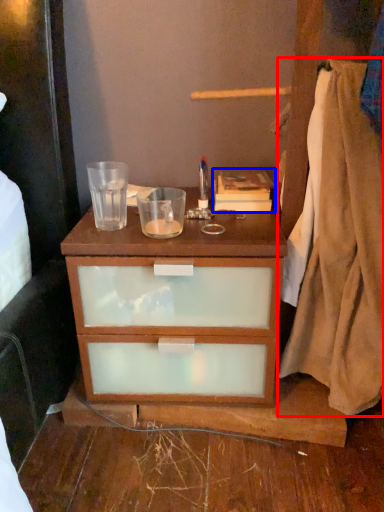
Question: Which object is further to the camera taking this photo, blanket (highlighted by a red box) or book (highlighted by a blue box)?

Choices:
 (A) blanket
 (B) book

Answer: (B)